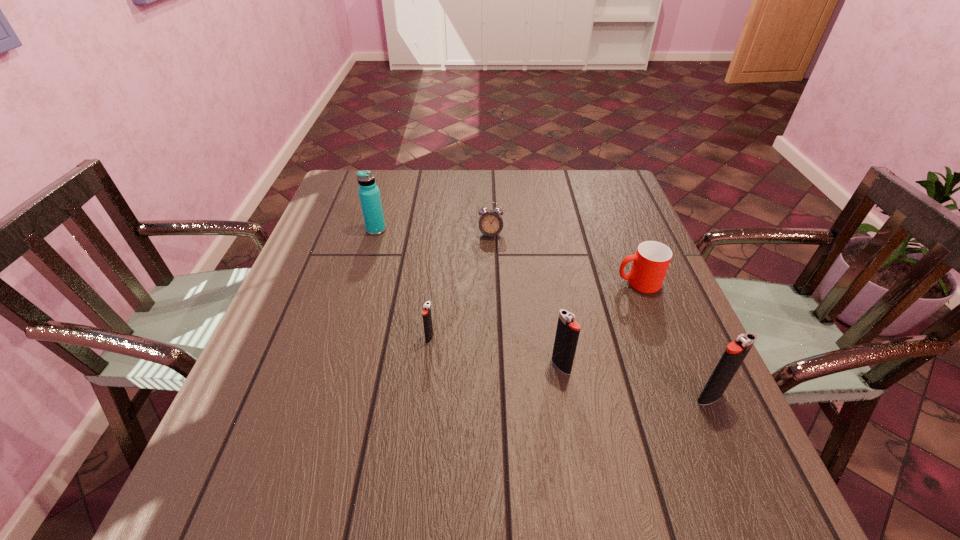
What are the coordinates of `free space at the far edge of the desktop` in the screenshot? It's located at (405, 191).

This screenshot has height=540, width=960. In the image, there is a desktop. What are the coordinates of `vacant space at the near edge` in the screenshot? It's located at (323, 407).

This screenshot has height=540, width=960. I want to click on vacant area at the left edge, so click(308, 341).

In the image, there is a desktop. Identify the location of vacant space at the right edge. The image size is (960, 540). (613, 273).

Find the location of a particular element. The width and height of the screenshot is (960, 540). free space at the far left corner is located at coordinates (334, 192).

This screenshot has height=540, width=960. I want to click on vacant space at the far right corner of the desktop, so click(x=621, y=186).

The width and height of the screenshot is (960, 540). I want to click on vacant space at the near right corner, so click(x=688, y=407).

This screenshot has width=960, height=540. I want to click on empty space between the shortest igniter and the leftmost object, so click(403, 284).

Locate an element on the screen. The image size is (960, 540). vacant area between the cup and the farthest igniter is located at coordinates (534, 310).

Find the location of `empty space between the leftmost object and the alarm clock`. empty space between the leftmost object and the alarm clock is located at coordinates (433, 232).